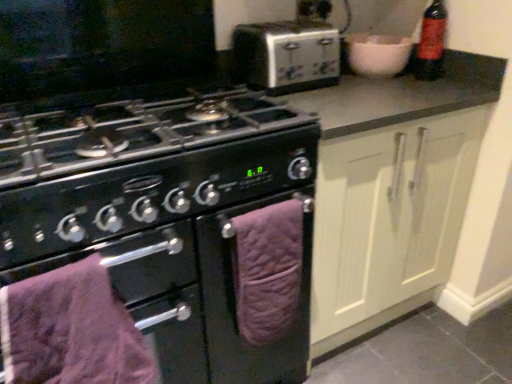
What do you see at coordinates (216, 229) in the screenshot? This screenshot has height=384, width=512. I see `black matte oven at center, positioned as the 1th oven in left-to-right order` at bounding box center [216, 229].

At what (x,y) coordinates should I click in order to perform the action: click on black matte oven at center, which is counted as the 2th oven, starting from the right. Please return your answer as a coordinate pair (x, y). The image size is (512, 384). Looking at the image, I should click on (216, 229).

Locate an element on the screen. This screenshot has width=512, height=384. purple quilted towel at lower left is located at coordinates (71, 330).

The image size is (512, 384). What do you see at coordinates (390, 214) in the screenshot? I see `cream matte cabinet doors at center-right` at bounding box center [390, 214].

Where is `cream matte cabinet doors at center-right`? The width and height of the screenshot is (512, 384). cream matte cabinet doors at center-right is located at coordinates (390, 214).

The image size is (512, 384). In order to click on red matte bottle at upper right in this screenshot , I will do `click(431, 42)`.

Locate an element on the screen. The image size is (512, 384). purple quilted towel at lower center, the 2th oven viewed from the left is located at coordinates (257, 290).

What do you see at coordinates (286, 56) in the screenshot? Image resolution: width=512 pixels, height=384 pixels. I see `silver metallic toaster at upper center` at bounding box center [286, 56].

What are the coordinates of `black matte oven at center, which is counted as the 2th oven, starting from the right` in the screenshot? It's located at (216, 229).

Does purple quilted towel at lower left have a greater width compared to red matte bottle at upper right?

Correct, the width of purple quilted towel at lower left exceeds that of red matte bottle at upper right.

Is point (92, 358) positioned after point (429, 64)?

No, (92, 358) is in front of (429, 64).

How much distance is there between purple quilted towel at lower left and red matte bottle at upper right?

The distance of purple quilted towel at lower left from red matte bottle at upper right is 4.14 feet.

The image size is (512, 384). Find the location of `bath towel lying in front of the red matte bottle at upper right`. bath towel lying in front of the red matte bottle at upper right is located at coordinates (71, 330).

Considering the positions of objects silver metallic toaster at upper center and purple quilted towel at lower left in the image provided, who is behind, silver metallic toaster at upper center or purple quilted towel at lower left?

silver metallic toaster at upper center.

Which object is positioned more to the left, silver metallic toaster at upper center or purple quilted towel at lower left?

purple quilted towel at lower left.

Can you confirm if silver metallic toaster at upper center is shorter than purple quilted towel at lower left?

Yes.

Looking at this image, which object is wider, silver metallic toaster at upper center or purple quilted towel at lower left?

With larger width is silver metallic toaster at upper center.

Which of these two, cream matte cabinet doors at center-right or black matte oven at center, which is counted as the 2th oven, starting from the right, stands taller?

With more height is cream matte cabinet doors at center-right.

From a real-world perspective, is cream matte cabinet doors at center-right on black matte oven at center, which is counted as the 2th oven, starting from the right?

Correct, in the physical world, cream matte cabinet doors at center-right is higher than black matte oven at center, which is counted as the 2th oven, starting from the right.

Is cream matte cabinet doors at center-right facing away from black matte oven at center, which is counted as the 2th oven, starting from the right?

No, black matte oven at center, which is counted as the 2th oven, starting from the right, is not at the back of cream matte cabinet doors at center-right.

Is black matte oven at center, positioned as the 1th oven in left-to-right order, surrounded by cream matte cabinet doors at center-right?

Actually, black matte oven at center, positioned as the 1th oven in left-to-right order, is outside cream matte cabinet doors at center-right.

Is purple quilted towel at lower center, the 2th oven viewed from the left, wider than cream matte cabinet doors at center-right?

No.

Who is shorter, purple quilted towel at lower center, the first oven viewed from the right, or cream matte cabinet doors at center-right?

purple quilted towel at lower center, the first oven viewed from the right, is shorter.

Where is `oven above the cream matte cabinet doors at center-right (from a real-world perspective)`? This screenshot has height=384, width=512. oven above the cream matte cabinet doors at center-right (from a real-world perspective) is located at coordinates (257, 290).

Could you measure the distance between purple quilted towel at lower center, the 2th oven viewed from the left, and cream matte cabinet doors at center-right?

The distance of purple quilted towel at lower center, the 2th oven viewed from the left, from cream matte cabinet doors at center-right is 11.54 inches.

From their relative heights in the image, would you say purple quilted towel at lower left is taller or shorter than silver metallic toaster at upper center?

In the image, purple quilted towel at lower left appears to be taller than silver metallic toaster at upper center.

In the scene shown: Which object is thinner, purple quilted towel at lower left or silver metallic toaster at upper center?

purple quilted towel at lower left.

Considering the positions of objects purple quilted towel at lower left and silver metallic toaster at upper center in the image provided, who is more to the right, purple quilted towel at lower left or silver metallic toaster at upper center?

silver metallic toaster at upper center.

Considering the sizes of objects purple quilted towel at lower left and silver metallic toaster at upper center in the image provided, who is smaller, purple quilted towel at lower left or silver metallic toaster at upper center?

purple quilted towel at lower left is smaller.

How different are the orientations of silver metallic toaster at upper center and cream matte cabinet doors at center-right in degrees?

The angle between the facing direction of silver metallic toaster at upper center and the facing direction of cream matte cabinet doors at center-right is 3.1 degrees.

From the image's perspective, is silver metallic toaster at upper center on top of cream matte cabinet doors at center-right?

Correct, silver metallic toaster at upper center appears higher than cream matte cabinet doors at center-right in the image.

From a real-world perspective, between silver metallic toaster at upper center and cream matte cabinet doors at center-right, who is vertically lower?

cream matte cabinet doors at center-right is physically lower.

Does cream matte cabinet doors at center-right have a greater height compared to silver metallic toaster at upper center?

Yes, cream matte cabinet doors at center-right is taller than silver metallic toaster at upper center.

What's the angular difference between cream matte cabinet doors at center-right and silver metallic toaster at upper center's facing directions?

The facing directions of cream matte cabinet doors at center-right and silver metallic toaster at upper center are 3.1 degrees apart.

Does cream matte cabinet doors at center-right contain silver metallic toaster at upper center?

Actually, silver metallic toaster at upper center is outside cream matte cabinet doors at center-right.

From a real-world perspective, is cream matte cabinet doors at center-right above or below silver metallic toaster at upper center?

Clearly, from a real-world perspective, cream matte cabinet doors at center-right is below silver metallic toaster at upper center.

Identify the location of bottle behind the purple quilted towel at lower left. Image resolution: width=512 pixels, height=384 pixels. (431, 42).

This screenshot has height=384, width=512. I want to click on bath towel lying on the left of silver metallic toaster at upper center, so click(71, 330).

Considering their positions, is purple quilted towel at lower left positioned closer to silver metallic toaster at upper center than purple quilted towel at lower center, the first oven viewed from the right?

Based on the image, purple quilted towel at lower center, the first oven viewed from the right, appears to be nearer to silver metallic toaster at upper center.

Based on their spatial positions, is cream matte cabinet doors at center-right or purple quilted towel at lower left further from silver metallic toaster at upper center?

purple quilted towel at lower left is positioned further to the anchor silver metallic toaster at upper center.

Looking at the image, which one is located closer to purple quilted towel at lower center, the 2th oven viewed from the left, red matte bottle at upper right or purple quilted towel at lower left?

purple quilted towel at lower left.

Looking at the image, which one is located further to cream matte cabinet doors at center-right, silver metallic toaster at upper center or purple quilted towel at lower center, the first oven viewed from the right?

silver metallic toaster at upper center is positioned further to the anchor cream matte cabinet doors at center-right.

Considering their positions, is purple quilted towel at lower center, the first oven viewed from the right, positioned further to red matte bottle at upper right than silver metallic toaster at upper center?

Based on the image, purple quilted towel at lower center, the first oven viewed from the right, appears to be further to red matte bottle at upper right.

Estimate the real-world distances between objects in this image. Which object is closer to purple quilted towel at lower center, the 2th oven viewed from the left, red matte bottle at upper right or black matte oven at center, positioned as the 1th oven in left-to-right order?

black matte oven at center, positioned as the 1th oven in left-to-right order, is positioned closer to the anchor purple quilted towel at lower center, the 2th oven viewed from the left.

Estimate the real-world distances between objects in this image. Which object is closer to cream matte cabinet doors at center-right, purple quilted towel at lower left or red matte bottle at upper right?

Based on the image, red matte bottle at upper right appears to be nearer to cream matte cabinet doors at center-right.

Looking at the image, which one is located further to purple quilted towel at lower left, red matte bottle at upper right or silver metallic toaster at upper center?

Among the two, red matte bottle at upper right is located further to purple quilted towel at lower left.

Find the location of `cabinetry located between purple quilted towel at lower left and red matte bottle at upper right in the left-right direction`. cabinetry located between purple quilted towel at lower left and red matte bottle at upper right in the left-right direction is located at coordinates (390, 214).

The height and width of the screenshot is (384, 512). In order to click on cabinetry located between black matte oven at center, which is counted as the 2th oven, starting from the right, and red matte bottle at upper right in the left-right direction in this screenshot , I will do `click(390, 214)`.

Image resolution: width=512 pixels, height=384 pixels. I want to click on cabinetry between silver metallic toaster at upper center and purple quilted towel at lower left from top to bottom, so click(x=390, y=214).

You are a GUI agent. You are given a task and a screenshot of the screen. Output one action in this format:
    pyautogui.click(x=<x>, y=<y>)
    Task: Click on the kitchen appliance between purple quilted towel at lower left and red matte bottle at upper right from left to right
    The height and width of the screenshot is (384, 512).
    Given the screenshot: What is the action you would take?
    pyautogui.click(x=286, y=56)